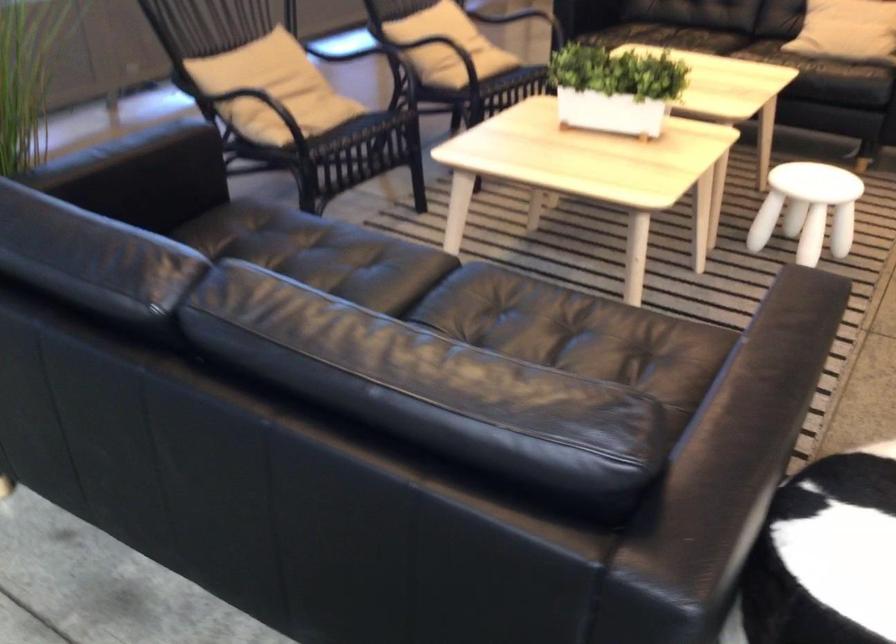
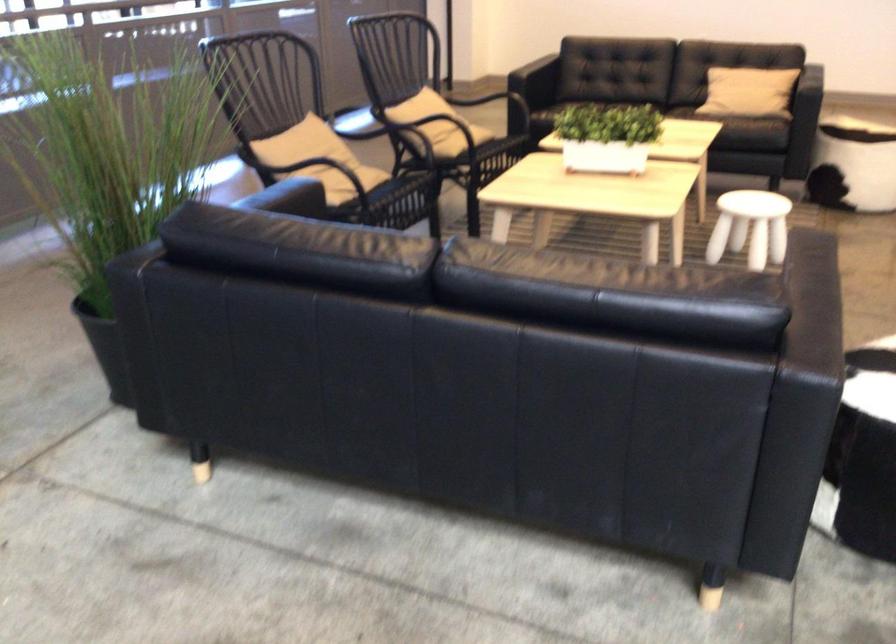
Find the pixel in the second image that matches (255,82) in the first image.

(308, 153)